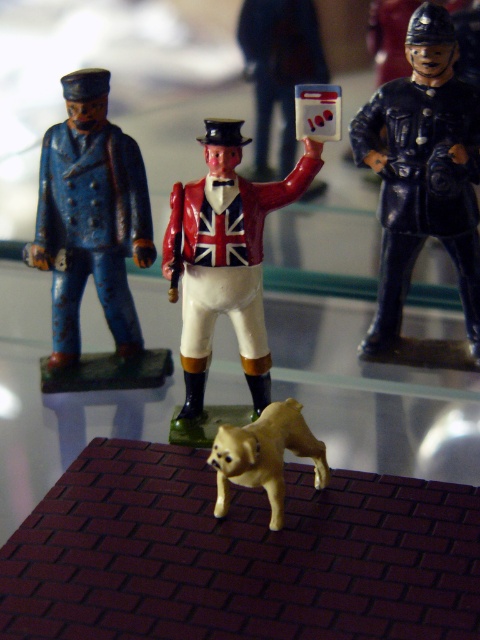
In the scene shown: Which of these two, glossy dark blue uniform at right or shiny gold dog at center, stands taller?

Standing taller between the two is glossy dark blue uniform at right.

Is glossy dark blue uniform at right in front of shiny gold dog at center?

No, it is not.

Is point (368, 161) behind point (218, 460)?

Yes.

This screenshot has height=640, width=480. Find the location of `glossy dark blue uniform at right`. glossy dark blue uniform at right is located at coordinates (422, 172).

Is matte blue uniform at left below shiny red plastic figure at center?

Actually, matte blue uniform at left is above shiny red plastic figure at center.

Is matte blue uniform at left shorter than shiny red plastic figure at center?

In fact, matte blue uniform at left may be taller than shiny red plastic figure at center.

Is point (66, 125) positioned after point (202, 198)?

That is True.

At what (x,y) coordinates should I click in order to perform the action: click on matte blue uniform at left. Please return your answer as a coordinate pair (x, y). The image size is (480, 640). Looking at the image, I should click on (91, 218).

In the scene shown: Is shiny red plastic figure at center thinner than shiny gold dog at center?

In fact, shiny red plastic figure at center might be wider than shiny gold dog at center.

Which is more to the right, shiny red plastic figure at center or shiny gold dog at center?

From the viewer's perspective, shiny gold dog at center appears more on the right side.

The height and width of the screenshot is (640, 480). What do you see at coordinates (225, 259) in the screenshot?
I see `shiny red plastic figure at center` at bounding box center [225, 259].

The image size is (480, 640). I want to click on shiny red plastic figure at center, so click(225, 259).